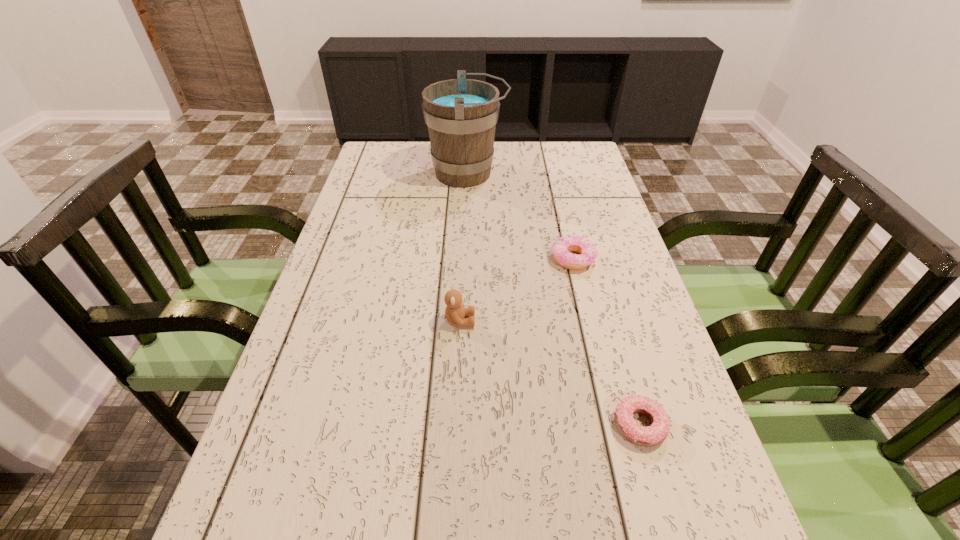
This screenshot has width=960, height=540. Identify the location of the farthest object. (461, 114).

You are a GUI agent. You are given a task and a screenshot of the screen. Output one action in this format:
    pyautogui.click(x=<x>, y=<y>)
    Task: Click on the tallest object
    The image size is (960, 540).
    Given the screenshot: What is the action you would take?
    pyautogui.click(x=461, y=114)

Where is `the third farthest object`? The width and height of the screenshot is (960, 540). the third farthest object is located at coordinates (455, 312).

Locate an element on the screen. Image resolution: width=960 pixels, height=540 pixels. teddy bear is located at coordinates (455, 312).

At what (x,y) coordinates should I click in order to perform the action: click on the farther doughnut. Please return your answer as a coordinate pair (x, y). The width and height of the screenshot is (960, 540). Looking at the image, I should click on (561, 247).

Image resolution: width=960 pixels, height=540 pixels. What are the coordinates of `the taller doughnut` in the screenshot? It's located at (561, 247).

This screenshot has width=960, height=540. Identify the location of the nearer doughnut. (655, 434).

At what (x,y) coordinates should I click in order to perform the action: click on the shorter doughnut. Please return your answer as a coordinate pair (x, y). Image resolution: width=960 pixels, height=540 pixels. Looking at the image, I should click on (655, 434).

This screenshot has height=540, width=960. In order to click on vacant space situated 0.130m with a handle on the side of the farthest object in this screenshot , I will do `click(546, 173)`.

Locate an element on the screen. free space located on the face of the teddy bear is located at coordinates (519, 321).